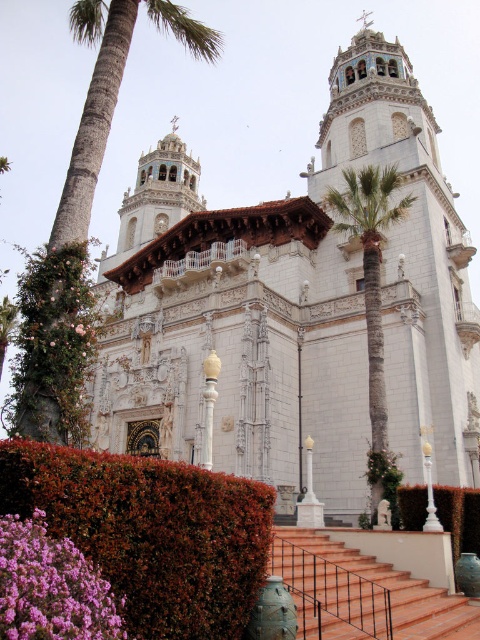
Question: Which of the following is the farthest from the observer?

Choices:
 (A) (26, 368)
 (B) (347, 228)

Answer: (B)

Question: Among these objects, which one is farthest from the camera?

Choices:
 (A) terracotta tile stairs at center
 (B) white stone church at center
 (C) green leafy hedge at lower center

Answer: (C)

Question: Is white stone church at center above purple matte flower at lower left?

Choices:
 (A) yes
 (B) no

Answer: (A)

Question: Observing the image, what is the correct spatial positioning of terracotta tile stairs at center in reference to green leafy hedge at lower center?

Choices:
 (A) right
 (B) left

Answer: (B)

Question: Among these points, which one is nearest to the camera?

Choices:
 (A) (371, 419)
 (B) (90, 586)
 (C) (417, 602)
 (D) (68, 248)

Answer: (B)

Question: Is white stone church at center further to camera compared to green leafy palm tree at center?

Choices:
 (A) no
 (B) yes

Answer: (A)